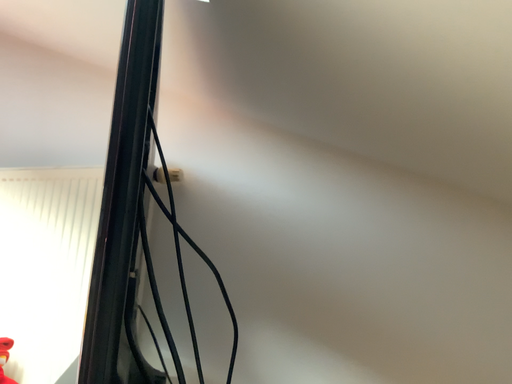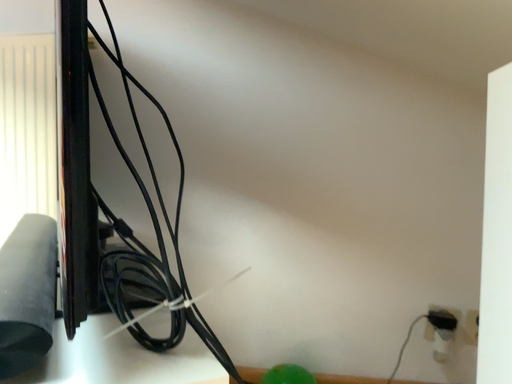
Question: How did the camera likely rotate when shooting the video?

Choices:
 (A) rotated right
 (B) rotated left

Answer: (A)